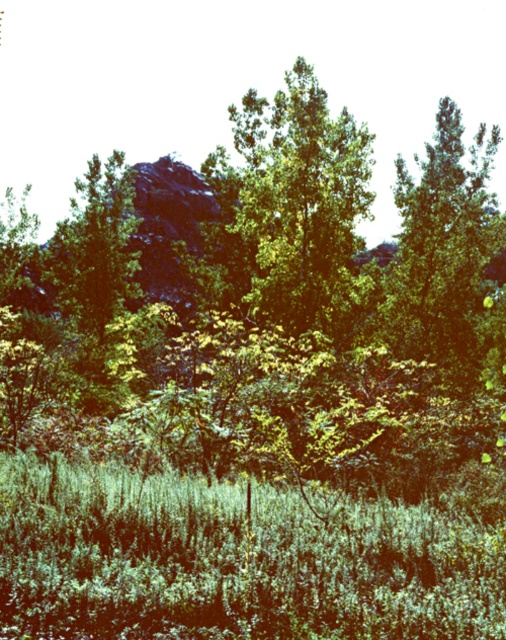
Between green leafy grass at lower center and green leafy tree at center, which one has more height?

green leafy tree at center

Does green leafy grass at lower center lie behind green leafy tree at center?

No, it is in front of green leafy tree at center.

Where is `green leafy grass at lower center`? The image size is (506, 640). green leafy grass at lower center is located at coordinates (233, 561).

This screenshot has height=640, width=506. In order to click on green leafy grass at lower center in this screenshot , I will do `click(233, 561)`.